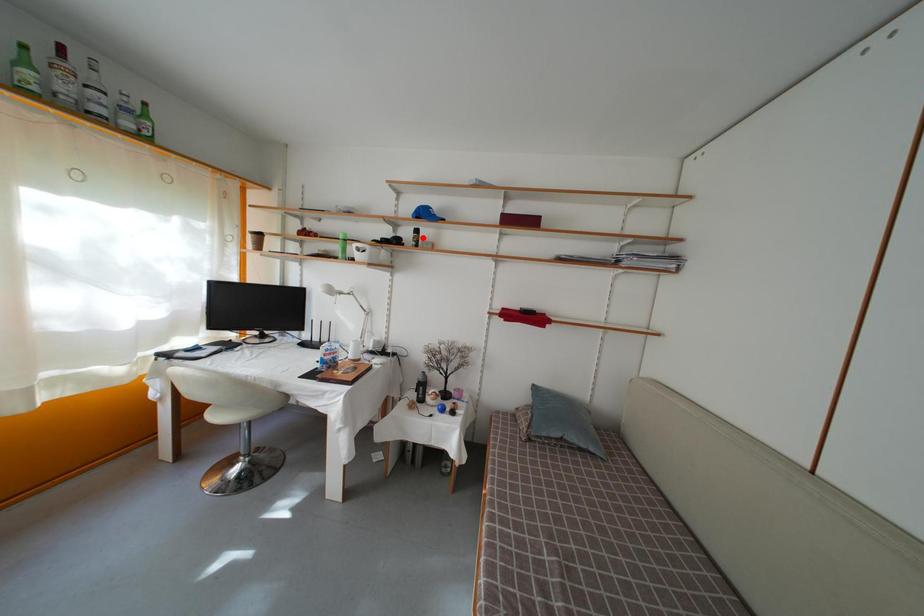
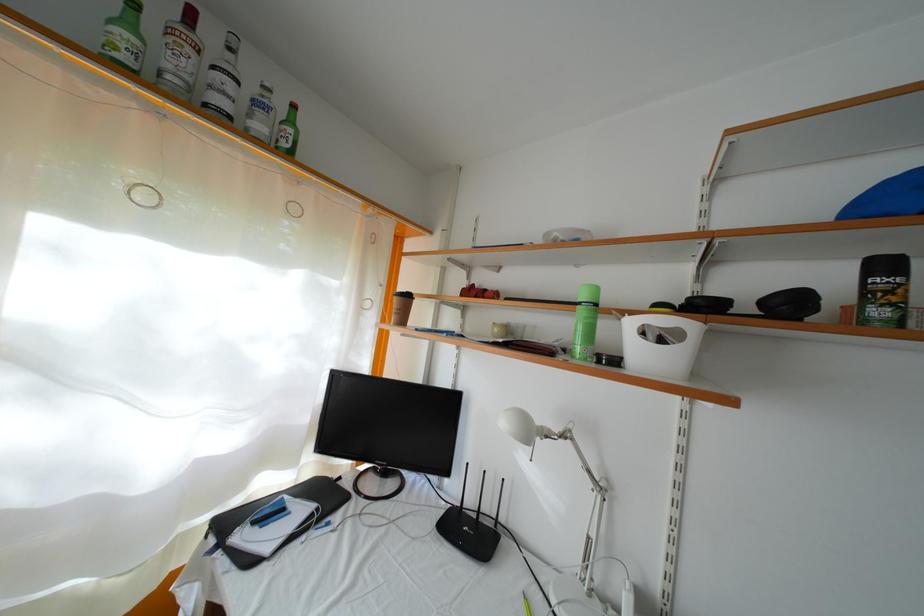
Find the pixel in the second image that matches the highlighted location in the first image.

(891, 273)